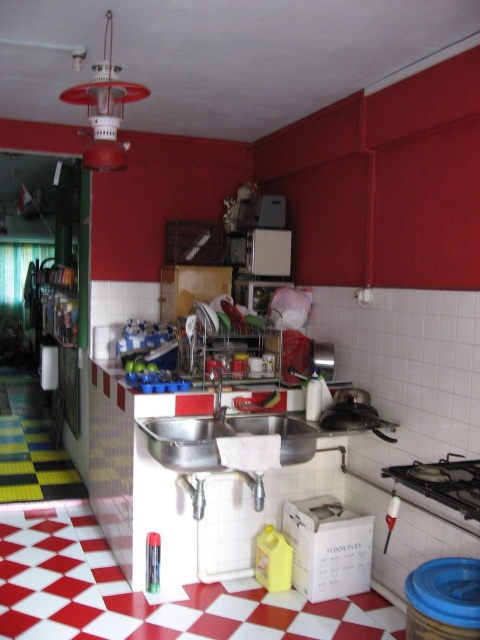
This screenshot has width=480, height=640. What are the coordinates of `stainless steel sink at center` in the screenshot? It's located at (222, 436).

Describe the element at coordinates (222, 436) in the screenshot. The width and height of the screenshot is (480, 640). I see `stainless steel sink at center` at that location.

Locate an element on the screen. This screenshot has height=640, width=480. stainless steel sink at center is located at coordinates (222, 436).

Does stainless steel sink at center appear on the right side of silver metallic sink at center?

Indeed, stainless steel sink at center is positioned on the right side of silver metallic sink at center.

Is stainless steel sink at center shorter than silver metallic sink at center?

Incorrect, stainless steel sink at center's height does not fall short of silver metallic sink at center's.

Who is more forward, (268, 419) or (200, 428)?

Point (200, 428) is more forward.

Locate an element on the screen. stainless steel sink at center is located at coordinates pyautogui.click(x=222, y=436).

Is black matte stove at upper right above silver metallic sink at center?

No.

Is point (470, 484) positioned in front of point (210, 426)?

Yes.

Is point (475, 504) less distant than point (215, 432)?

Yes, it is.

Identify the location of black matte stove at upper right. The width and height of the screenshot is (480, 640). (443, 483).